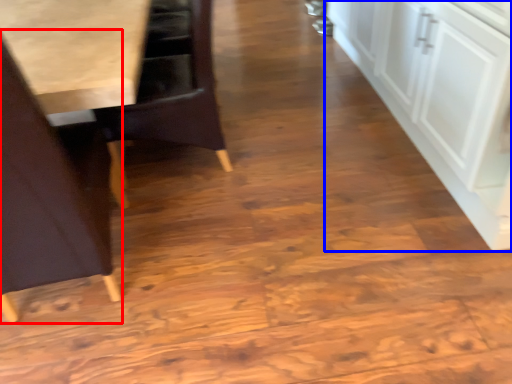
Question: Which of the following is the closest to the observer, chair (highlighted by a red box) or cabinetry (highlighted by a blue box)?

Choices:
 (A) chair
 (B) cabinetry

Answer: (A)